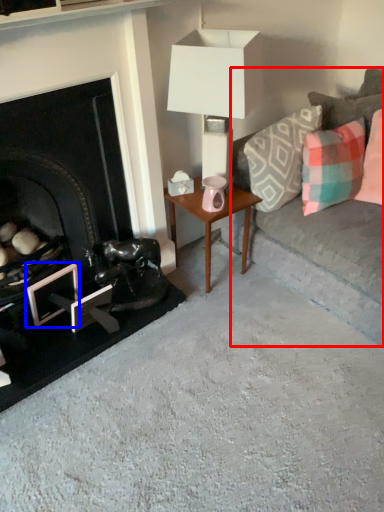
Question: Which object is further to the camera taking this photo, studio couch (highlighted by a red box) or picture frame (highlighted by a blue box)?

Choices:
 (A) studio couch
 (B) picture frame

Answer: (B)